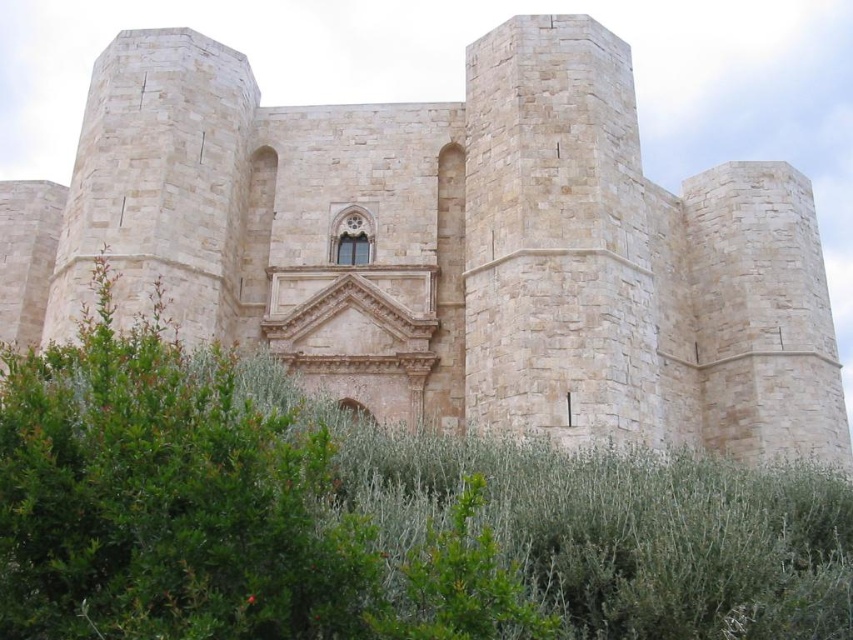
You are a landscape architect planning to place a new statue in the courtyard. The statue requires a base that must be wider than the green leafy bush at center but narrower than the beige stone castle at center. Can you position the statue between them without exceeding the width constraints?

The beige stone castle at center is wider than the green leafy bush at center. Therefore, the statue base can be placed between them as long as its width is greater than the green leafy bush at center but less than the beige stone castle at center.

You are standing in front of the beige stone castle at center and the green leafy bush at center. Which object is located to the left of the other?

The green leafy bush at center is located to the left of the beige stone castle at center because the beige stone castle at center is positioned on the right side of green leafy bush at center.